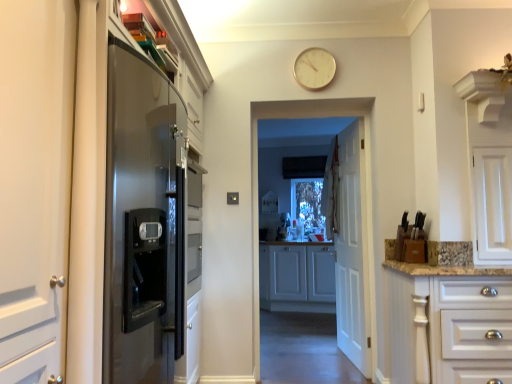
Question: From a real-world perspective, is white matte cabinet at center, the second cabinetry from the front, positioned above or below white glossy cabinet at right, acting as the 2th cabinetry starting from the back?

Choices:
 (A) below
 (B) above

Answer: (A)

Question: Looking at their shapes, would you say white matte cabinet at center, the 1th cabinetry viewed from the back, is wider or thinner than white glossy cabinet at right, acting as the 2th cabinetry starting from the back?

Choices:
 (A) thin
 (B) wide

Answer: (A)

Question: Which of these objects is positioned closest to the white glossy cabinet at right, which appears as the first cabinetry when viewed from the front?

Choices:
 (A) white matte cabinet at center, the second cabinetry from the front
 (B) white wooden door at center
 (C) white glossy cabinets at center
 (D) gold metallic clock at upper center

Answer: (B)

Question: Which of these objects is positioned farthest from the gold metallic clock at upper center?

Choices:
 (A) white glossy cabinets at center
 (B) white matte cabinet at center, the second cabinetry from the front
 (C) white glossy cabinet at right, acting as the 2th cabinetry starting from the back
 (D) white wooden door at center

Answer: (B)